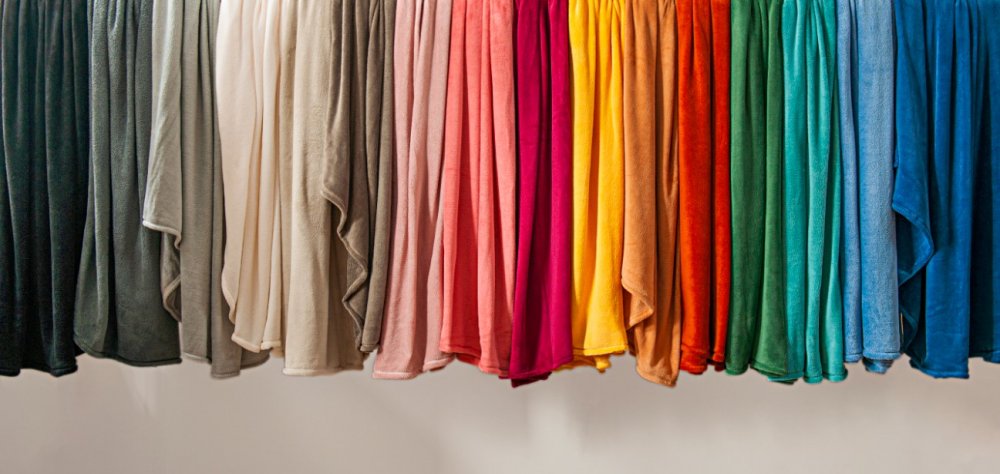
Find the location of a particular element. Image resolution: width=1000 pixels, height=474 pixels. neutral coloured towels is located at coordinates (29, 281), (125, 289), (195, 285), (265, 284), (353, 273).